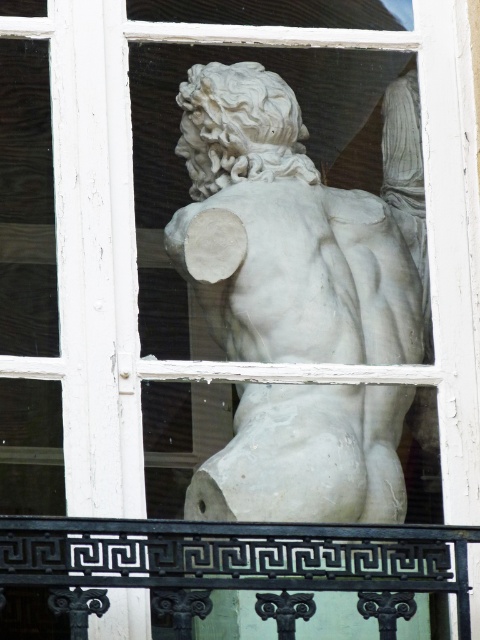
You are an art conservator examining the sculpture through the window. You notice the black wrought iron at lower center and the white marble torso at center. Which object is closer to the window?

The white marble torso at center is closer to the window than the black wrought iron at lower center because the black wrought iron at lower center is behind the white marble torso at center.

You are an interior designer planning to place a new decorative item between the white marble torso at center and the black wrought iron at lower center. Considering their widths, which object should you place closer to the narrower side to maintain balance?

The white marble torso at center is thinner than the black wrought iron at lower center, so you should place the new decorative item closer to the white marble torso at center to maintain balance by balancing the widths.